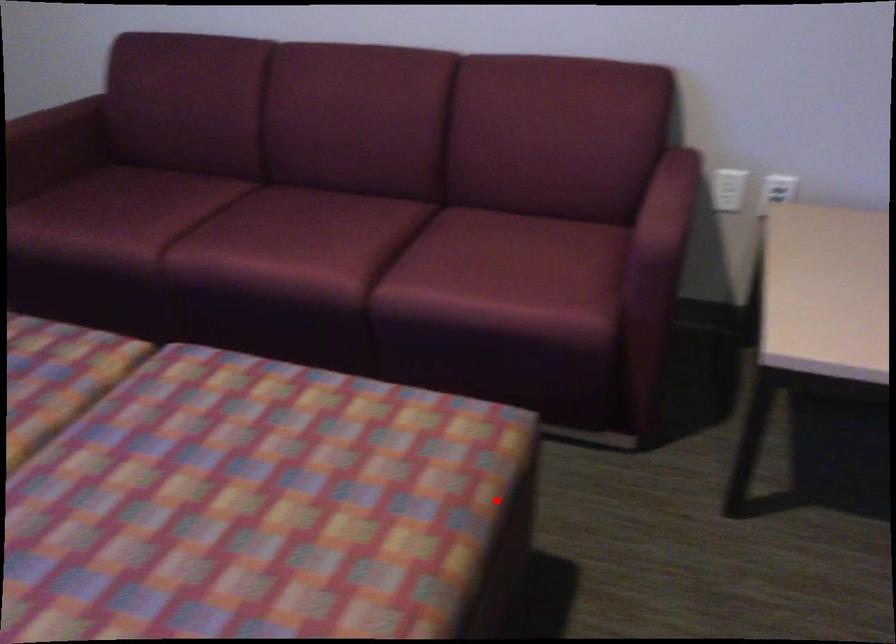
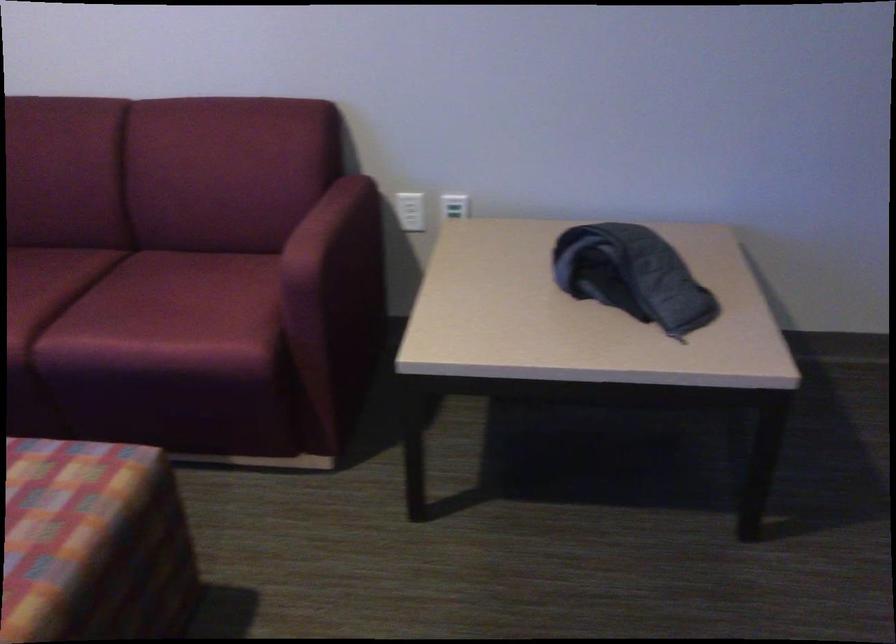
Where in the second image is the point corresponding to the highlighted location from the first image?

(93, 544)